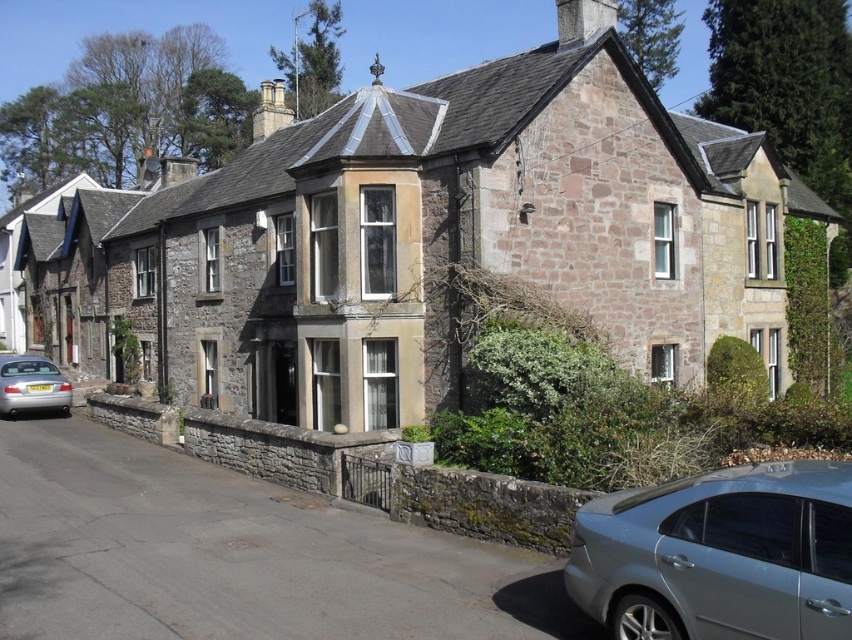
Between satin silver sedan at lower right and silver metallic car at lower left, which one appears on the right side from the viewer's perspective?

satin silver sedan at lower right

Does satin silver sedan at lower right have a smaller size compared to silver metallic car at lower left?

Correct, satin silver sedan at lower right occupies less space than silver metallic car at lower left.

This screenshot has height=640, width=852. I want to click on satin silver sedan at lower right, so click(718, 556).

What are the coordinates of `satin silver sedan at lower right` in the screenshot? It's located at (718, 556).